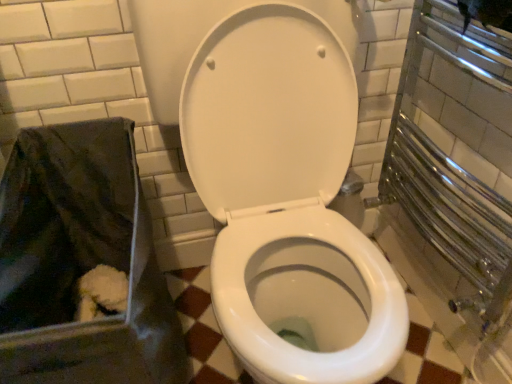
Question: From a real-world perspective, is black fabric bag at lower left under white glossy toilet at center?

Choices:
 (A) no
 (B) yes

Answer: (B)

Question: Does black fabric bag at lower left have a greater height compared to white glossy toilet at center?

Choices:
 (A) yes
 (B) no

Answer: (B)

Question: From the image's perspective, is black fabric bag at lower left over white glossy toilet at center?

Choices:
 (A) yes
 (B) no

Answer: (B)

Question: Is black fabric bag at lower left at the right side of white glossy toilet at center?

Choices:
 (A) no
 (B) yes

Answer: (A)

Question: From the image's perspective, is black fabric bag at lower left under white glossy toilet at center?

Choices:
 (A) no
 (B) yes

Answer: (B)

Question: Can you confirm if black fabric bag at lower left is bigger than white glossy toilet at center?

Choices:
 (A) yes
 (B) no

Answer: (B)

Question: Is the depth of white glossy toilet at center greater than that of black fabric bag at lower left?

Choices:
 (A) no
 (B) yes

Answer: (A)

Question: Considering the relative positions of white glossy toilet at center and black fabric bag at lower left in the image provided, is white glossy toilet at center to the left of black fabric bag at lower left from the viewer's perspective?

Choices:
 (A) no
 (B) yes

Answer: (A)

Question: Is white glossy toilet at center next to black fabric bag at lower left?

Choices:
 (A) no
 (B) yes

Answer: (A)

Question: Is white glossy toilet at center located outside black fabric bag at lower left?

Choices:
 (A) no
 (B) yes

Answer: (B)

Question: Does white glossy toilet at center lie in front of black fabric bag at lower left?

Choices:
 (A) no
 (B) yes

Answer: (B)

Question: Is white glossy toilet at center far away from black fabric bag at lower left?

Choices:
 (A) no
 (B) yes

Answer: (A)

Question: From a real-world perspective, is white glossy toilet at center positioned above or below black fabric bag at lower left?

Choices:
 (A) below
 (B) above

Answer: (B)